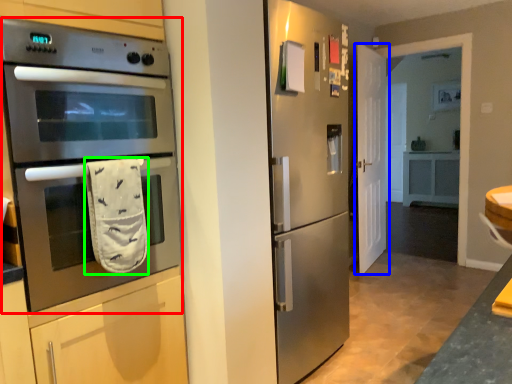
Question: Which object is positioned closest to microwave oven (highlighted by a red box)? Select from door (highlighted by a blue box) and hand towel (highlighted by a green box).

Choices:
 (A) door
 (B) hand towel

Answer: (B)